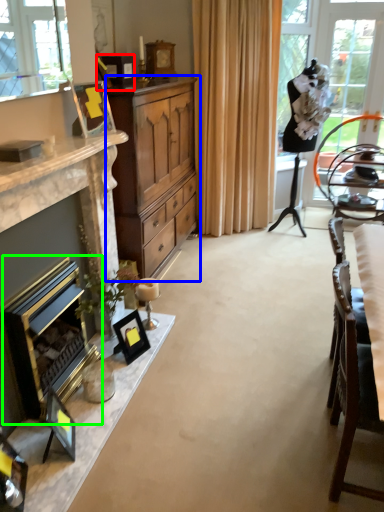
Question: Based on their relative distances, which object is farther from picture frame (highlighted by a red box)? Choose from cabinetry (highlighted by a blue box) and fireplace (highlighted by a green box).

Choices:
 (A) cabinetry
 (B) fireplace

Answer: (B)